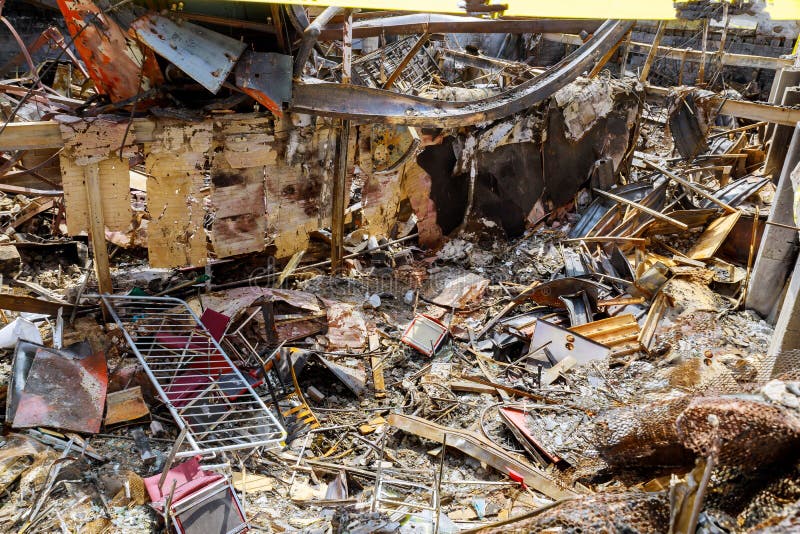
Image resolution: width=800 pixels, height=534 pixels. Identify the location of red panel. (116, 58), (28, 412).